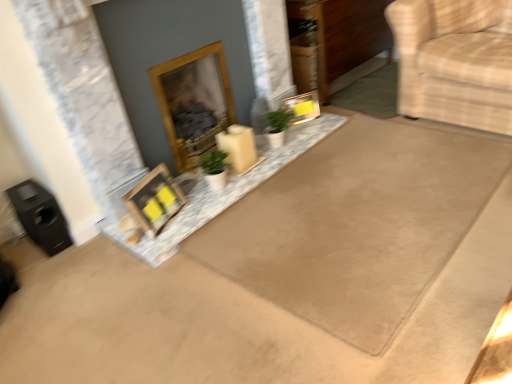
Locate an element on the screen. free space in front of white marble tray at center is located at coordinates (265, 269).